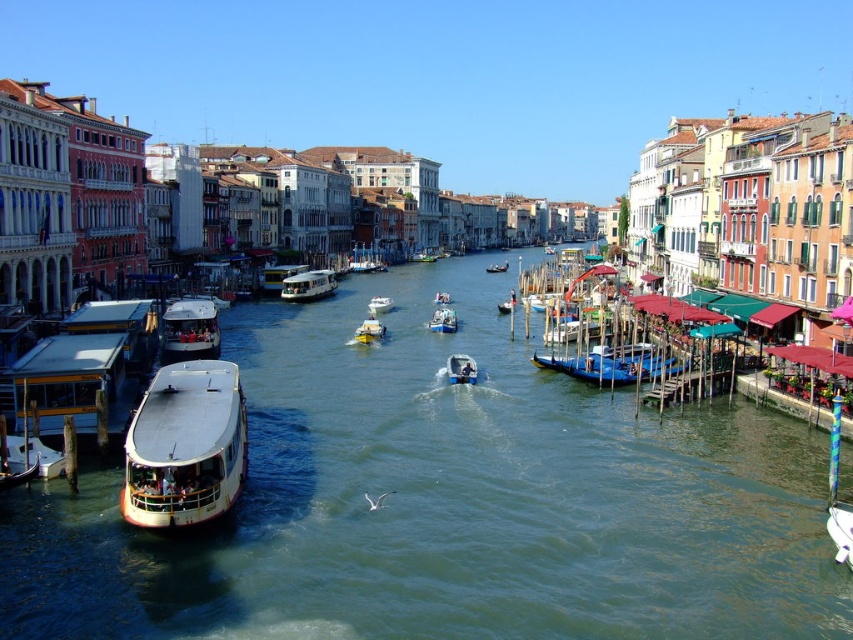
You are a tourist standing on the bridge overlooking the Grand Canal in Venice. You notice two boats below you, the white glossy boat at center and the metallic blue boat at center. Which boat has a higher height?

The white glossy boat at center is taller than the metallic blue boat at center, so the white glossy boat at center has a higher height.